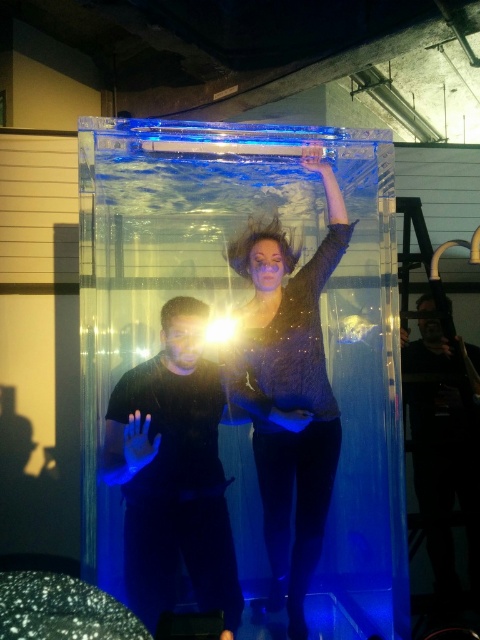
You are an event planner organizing a photoshoot inside the transparent acrylic tank at center. The model is wearing a matte black dress at center. Will the dress be fully visible from outside the tank?

The transparent acrylic tank at center is larger in size than the matte black dress at center, so the dress will be fully visible from outside the tank.

You are standing in front of an interactive water tank installation. You see a matte black dress at center inside the tank. If you want to touch the dress without entering the tank, can you reach it from your current position?

The matte black dress at center and viewer are 2.28 meters apart from each other, so you cannot reach the dress without entering the tank since the distance is too far.